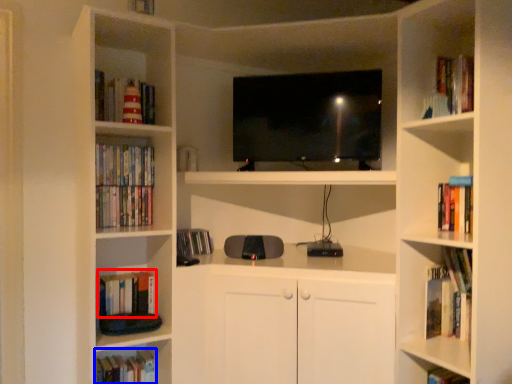
Question: Which of the following is the closest to the observer, book (highlighted by a red box) or book (highlighted by a blue box)?

Choices:
 (A) book
 (B) book

Answer: (A)